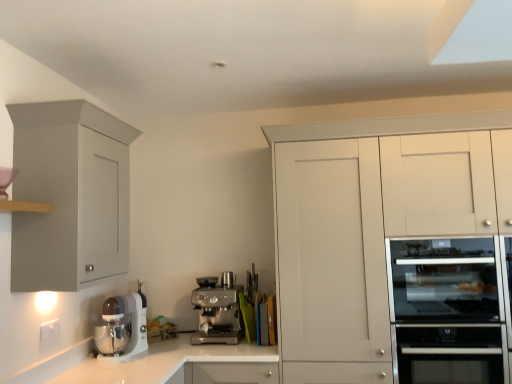
Question: Considering the relative sizes of stainless steel oven at right and satin silver oven at right in the image provided, is stainless steel oven at right bigger than satin silver oven at right?

Choices:
 (A) yes
 (B) no

Answer: (B)

Question: Is stainless steel oven at right positioned with its back to satin silver oven at right?

Choices:
 (A) yes
 (B) no

Answer: (B)

Question: Can you confirm if stainless steel oven at right is thinner than satin silver oven at right?

Choices:
 (A) no
 (B) yes

Answer: (B)

Question: From a real-world perspective, is stainless steel oven at right over satin silver oven at right?

Choices:
 (A) yes
 (B) no

Answer: (B)

Question: From the image's perspective, is stainless steel oven at right below satin silver oven at right?

Choices:
 (A) no
 (B) yes

Answer: (B)

Question: Considering the relative sizes of stainless steel oven at right and satin silver oven at right in the image provided, is stainless steel oven at right taller than satin silver oven at right?

Choices:
 (A) no
 (B) yes

Answer: (A)

Question: Is white matte cabinet at right, the first cabinetry in the right-to-left sequence, located outside matte gray cabinet at left, acting as the first cabinetry starting from the left?

Choices:
 (A) no
 (B) yes

Answer: (B)

Question: From a real-world perspective, is white matte cabinet at right, the second cabinetry when ordered from left to right, beneath matte gray cabinet at left, which is counted as the 2th cabinetry, starting from the right?

Choices:
 (A) no
 (B) yes

Answer: (B)

Question: Is white matte cabinet at right, the second cabinetry when ordered from left to right, at the left side of matte gray cabinet at left, which is counted as the 2th cabinetry, starting from the right?

Choices:
 (A) no
 (B) yes

Answer: (A)

Question: Can you confirm if white matte cabinet at right, the first cabinetry in the right-to-left sequence, is taller than matte gray cabinet at left, acting as the first cabinetry starting from the left?

Choices:
 (A) no
 (B) yes

Answer: (B)

Question: Would you say white matte cabinet at right, the first cabinetry in the right-to-left sequence, contains matte gray cabinet at left, acting as the first cabinetry starting from the left?

Choices:
 (A) yes
 (B) no

Answer: (B)

Question: Is the position of white matte cabinet at right, the first cabinetry in the right-to-left sequence, less distant than that of matte gray cabinet at left, which is counted as the 2th cabinetry, starting from the right?

Choices:
 (A) no
 (B) yes

Answer: (A)

Question: Is satin silver oven at right taller than white glossy countertop at center?

Choices:
 (A) yes
 (B) no

Answer: (B)